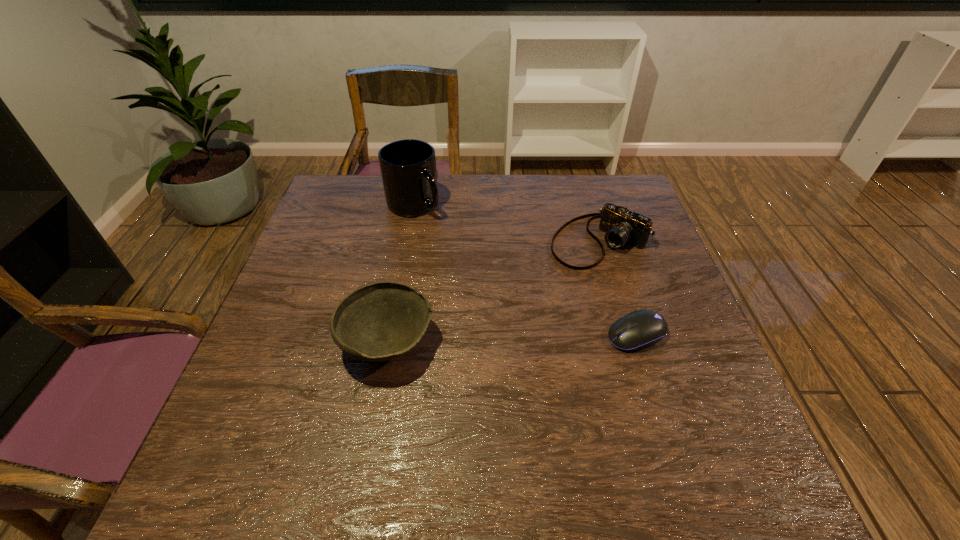
Identify the location of the third shortest object. (381, 321).

Find the location of a particular element. Image resolution: width=960 pixels, height=540 pixels. computer mouse is located at coordinates (640, 329).

Identify the location of the tallest object. The width and height of the screenshot is (960, 540). (408, 167).

Identify the location of camera. (621, 226).

The height and width of the screenshot is (540, 960). Find the location of `vacant space located 0.130m on the back of the second tallest object`. vacant space located 0.130m on the back of the second tallest object is located at coordinates (401, 271).

Locate an element on the screen. The image size is (960, 540). vacant area located on the back of the computer mouse is located at coordinates (611, 254).

Locate an element on the screen. This screenshot has width=960, height=540. vacant region located 0.170m with the handle on the side of the mug is located at coordinates (447, 256).

Where is `vacant point located with the handle on the side of the mug`? This screenshot has height=540, width=960. vacant point located with the handle on the side of the mug is located at coordinates (451, 263).

The image size is (960, 540). Find the location of `vacant area situated with the handle on the side of the mug`. vacant area situated with the handle on the side of the mug is located at coordinates (465, 282).

Identify the location of blank area located on the front-facing side of the third tallest object. (547, 281).